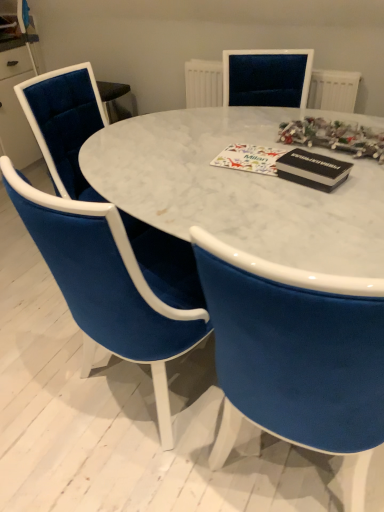
The image size is (384, 512). I want to click on free space on the front side of white matte christmas card at center, so click(x=252, y=187).